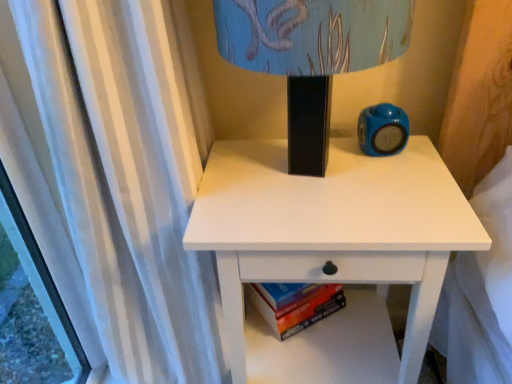
Question: From the image's perspective, is matte plastic alarm clock at upper right over matte black lampshade at upper center?

Choices:
 (A) no
 (B) yes

Answer: (A)

Question: From the image's perspective, does matte plastic alarm clock at upper right appear lower than matte black lampshade at upper center?

Choices:
 (A) no
 (B) yes

Answer: (B)

Question: Are matte plastic alarm clock at upper right and matte black lampshade at upper center far apart?

Choices:
 (A) no
 (B) yes

Answer: (A)

Question: Does matte plastic alarm clock at upper right have a greater height compared to matte black lampshade at upper center?

Choices:
 (A) yes
 (B) no

Answer: (B)

Question: Can you confirm if matte plastic alarm clock at upper right is positioned to the left of matte black lampshade at upper center?

Choices:
 (A) no
 (B) yes

Answer: (A)

Question: From the image's perspective, relative to hardcover book at lower center, is matte black lampshade at upper center above or below?

Choices:
 (A) above
 (B) below

Answer: (A)

Question: Would you say matte black lampshade at upper center is to the left or to the right of hardcover book at lower center in the picture?

Choices:
 (A) left
 (B) right

Answer: (A)

Question: Is point (303, 89) closer or farther from the camera than point (338, 294)?

Choices:
 (A) closer
 (B) farther

Answer: (A)

Question: In the image, is matte black lampshade at upper center positioned in front of or behind hardcover book at lower center?

Choices:
 (A) front
 (B) behind

Answer: (A)

Question: Is hardcover book at lower center to the left or to the right of matte black lampshade at upper center in the image?

Choices:
 (A) left
 (B) right

Answer: (B)

Question: Is point (311, 314) positioned closer to the camera than point (387, 13)?

Choices:
 (A) farther
 (B) closer

Answer: (A)

Question: Considering the positions of hardcover book at lower center and matte black lampshade at upper center in the image, is hardcover book at lower center wider or thinner than matte black lampshade at upper center?

Choices:
 (A) thin
 (B) wide

Answer: (A)

Question: Considering the positions of hardcover book at lower center and matte black lampshade at upper center in the image, is hardcover book at lower center bigger or smaller than matte black lampshade at upper center?

Choices:
 (A) big
 (B) small

Answer: (B)

Question: In terms of size, does white matte nightstand at center appear bigger or smaller than matte black lampshade at upper center?

Choices:
 (A) small
 (B) big

Answer: (B)

Question: From the image's perspective, is white matte nightstand at center positioned above or below matte black lampshade at upper center?

Choices:
 (A) above
 (B) below

Answer: (B)